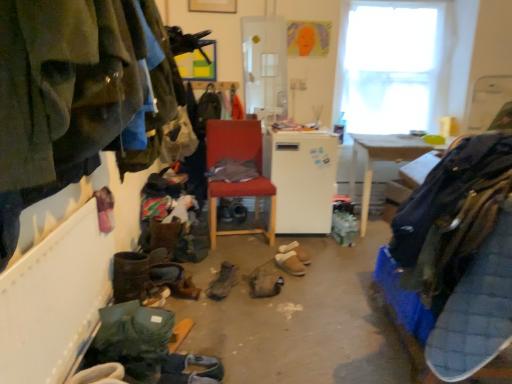
Question: Would you say brown suede sandals at center, the first footwear in the back-to-front sequence, is outside matte red chair at center?

Choices:
 (A) no
 (B) yes

Answer: (B)

Question: Is the position of brown suede sandals at center, the first footwear in the back-to-front sequence, less distant than that of matte red chair at center?

Choices:
 (A) yes
 (B) no

Answer: (A)

Question: Considering the relative sizes of brown suede sandals at center, the first footwear in the back-to-front sequence, and matte red chair at center in the image provided, is brown suede sandals at center, the first footwear in the back-to-front sequence, wider than matte red chair at center?

Choices:
 (A) yes
 (B) no

Answer: (B)

Question: Is brown suede sandals at center, which is the sixth footwear from front to back, to the right of matte red chair at center from the viewer's perspective?

Choices:
 (A) no
 (B) yes

Answer: (B)

Question: From the image's perspective, is brown suede sandals at center, which is the sixth footwear from front to back, located beneath matte red chair at center?

Choices:
 (A) yes
 (B) no

Answer: (A)

Question: In terms of width, does dark blue fabric at right, placed as the second clothing when sorted from left to right, look wider or thinner when compared to leather boot at center, which is the fourth footwear from front to back?

Choices:
 (A) wide
 (B) thin

Answer: (A)

Question: Considering the relative positions of dark blue fabric at right, placed as the second clothing when sorted from left to right, and leather boot at center, which is the fourth footwear from front to back, in the image provided, is dark blue fabric at right, placed as the second clothing when sorted from left to right, to the left or to the right of leather boot at center, which is the fourth footwear from front to back,?

Choices:
 (A) right
 (B) left

Answer: (A)

Question: From their relative heights in the image, would you say dark blue fabric at right, which appears as the first clothing when viewed from the right, is taller or shorter than leather boot at center, arranged as the 3th footwear when viewed from the back?

Choices:
 (A) short
 (B) tall

Answer: (B)

Question: Is point (438, 289) positioned closer to the camera than point (259, 279)?

Choices:
 (A) closer
 (B) farther

Answer: (A)

Question: Looking at their shapes, would you say leather boot at center, which is the fourth footwear from front to back, is wider or thinner than leather boots at center, which ranks as the fourth footwear in back-to-front order?

Choices:
 (A) wide
 (B) thin

Answer: (A)

Question: From the image's perspective, is leather boot at center, which is the fourth footwear from front to back, above or below leather boots at center, which ranks as the fourth footwear in back-to-front order?

Choices:
 (A) above
 (B) below

Answer: (B)

Question: In terms of height, does leather boot at center, arranged as the 3th footwear when viewed from the back, look taller or shorter compared to leather boots at center, which ranks as the fourth footwear in back-to-front order?

Choices:
 (A) short
 (B) tall

Answer: (A)

Question: From a real-world perspective, is leather boot at center, which is the fourth footwear from front to back, positioned above or below leather boots at center, marked as the third footwear in a front-to-back arrangement?

Choices:
 (A) above
 (B) below

Answer: (B)

Question: Looking at their shapes, would you say leather boots at lower center, the fifth footwear from the back, is wider or thinner than transparent glass window at upper right?

Choices:
 (A) thin
 (B) wide

Answer: (B)

Question: In the image, is leather boots at lower center, the fifth footwear from the back, positioned in front of or behind transparent glass window at upper right?

Choices:
 (A) behind
 (B) front

Answer: (B)